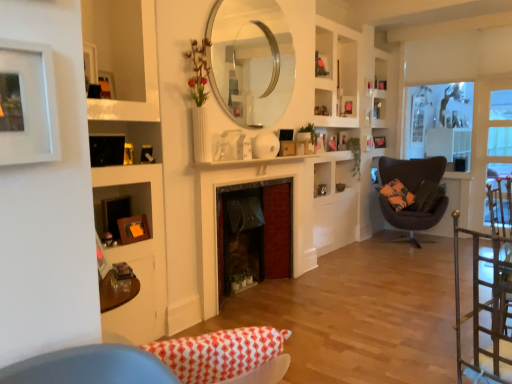
Question: Which direction should I rotate to face wooden picture frame at upper center, marked as the 4th picture frame in a top-to-bottom arrangement, — up or down?

Choices:
 (A) up
 (B) down

Answer: (A)

Question: Is metallic gold chair at right, acting as the 2th chair starting from the back, oriented away from white matte picture frame at upper left, positioned as the eighth picture frame in back-to-front order?

Choices:
 (A) yes
 (B) no

Answer: (B)

Question: Is metallic gold chair at right, which appears as the 1th chair when viewed from the left, next to white matte picture frame at upper left, placed as the 7th picture frame when sorted from right to left?

Choices:
 (A) yes
 (B) no

Answer: (B)

Question: Considering the relative sizes of metallic gold chair at right, acting as the second chair starting from the right, and white matte picture frame at upper left, placed as the 7th picture frame when sorted from right to left, in the image provided, is metallic gold chair at right, acting as the second chair starting from the right, wider than white matte picture frame at upper left, placed as the 7th picture frame when sorted from right to left,?

Choices:
 (A) yes
 (B) no

Answer: (A)

Question: Could you tell me if metallic gold chair at right, which appears as the 1th chair when viewed from the left, is turned towards white matte picture frame at upper left, placed as the 7th picture frame when sorted from right to left?

Choices:
 (A) no
 (B) yes

Answer: (A)

Question: Can you confirm if metallic gold chair at right, acting as the second chair starting from the right, is taller than white matte picture frame at upper left, which is the seventh picture frame from top to bottom?

Choices:
 (A) yes
 (B) no

Answer: (A)

Question: From the image's perspective, would you say metallic gold chair at right, acting as the 2th chair starting from the back, is positioned over white matte picture frame at upper left, placed as the 7th picture frame when sorted from right to left?

Choices:
 (A) no
 (B) yes

Answer: (A)

Question: Is wooden picture frame at center, acting as the fourth picture frame starting from the bottom, a part of matte black picture frame at upper right, acting as the third picture frame starting from the top?

Choices:
 (A) no
 (B) yes

Answer: (A)

Question: Is matte black picture frame at upper right, placed as the seventh picture frame when sorted from left to right, oriented away from wooden picture frame at center, acting as the fourth picture frame starting from the bottom?

Choices:
 (A) yes
 (B) no

Answer: (B)

Question: Does matte black picture frame at upper right, acting as the third picture frame starting from the top, have a lesser width compared to wooden picture frame at center, the 5th picture frame positioned from the left?

Choices:
 (A) yes
 (B) no

Answer: (B)

Question: Is matte black picture frame at upper right, acting as the third picture frame starting from the top, touching wooden picture frame at center, placed as the 5th picture frame when sorted from top to bottom?

Choices:
 (A) yes
 (B) no

Answer: (B)

Question: Considering the relative sizes of matte black picture frame at upper right, acting as the third picture frame starting from the top, and wooden picture frame at center, placed as the 5th picture frame when sorted from top to bottom, in the image provided, is matte black picture frame at upper right, acting as the third picture frame starting from the top, smaller than wooden picture frame at center, placed as the 5th picture frame when sorted from top to bottom,?

Choices:
 (A) no
 (B) yes

Answer: (A)

Question: From the image's perspective, is matte black picture frame at upper right, the third picture frame from the back, under wooden picture frame at center, the fifth picture frame viewed from the front?

Choices:
 (A) yes
 (B) no

Answer: (B)

Question: From the image's perspective, does wooden picture frame at upper center, positioned as the 5th picture frame in right-to-left order, appear lower than wooden picture frame at center, the fifth picture frame viewed from the front?

Choices:
 (A) no
 (B) yes

Answer: (A)